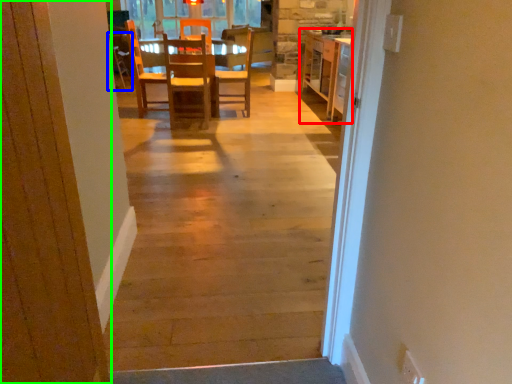
Question: Which object is the farthest from cabinetry (highlighted by a red box)? Choose among these: armchair (highlighted by a blue box) or door (highlighted by a green box).

Choices:
 (A) armchair
 (B) door

Answer: (B)